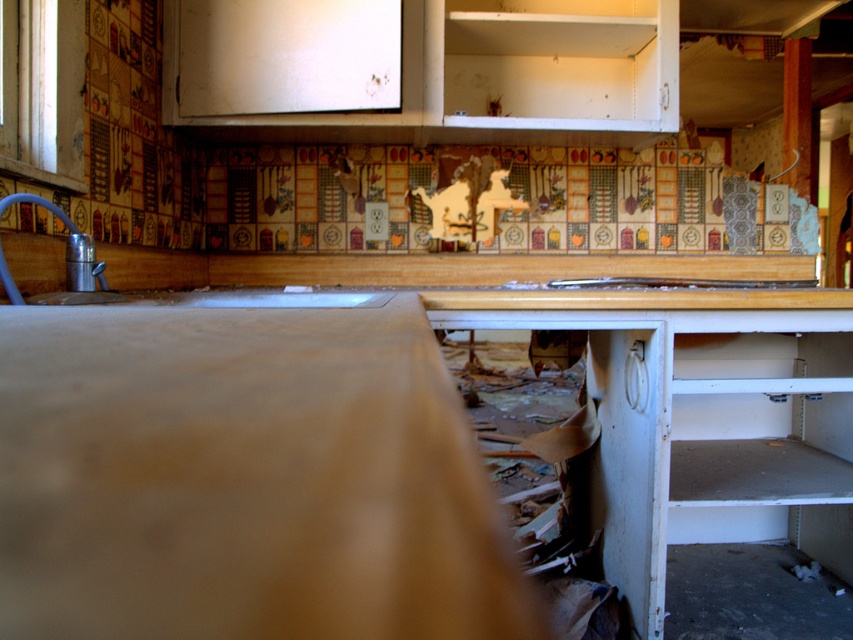
You are a repair worker assessing the kitchen. You need to reach both the matte wood counter top at center and the white matte cabinet at upper center to inspect for damage. Which object will you need to reach first?

The matte wood counter top at center is closer to the viewer than the white matte cabinet at upper center, so you will need to reach the matte wood counter top at center first before the white matte cabinet at upper center.

You are a repair technician assessing the kitchen. You need to install a new shelf between the white matte cabinet at upper center and the silver metallic faucet at left. Which object should the shelf be placed below to ensure it fits properly?

The shelf should be placed below the white matte cabinet at upper center because it is taller than the silver metallic faucet at left, ensuring there is enough vertical space for the shelf between them.

You are a plumber inspecting the kitchen and need to locate the main water valve. According to the image, where would you find the matte wood counter top at center in relation to the silver metallic faucet at left?

The matte wood counter top at center is below the silver metallic faucet at left, so the valve is likely located under the counter near the faucet.